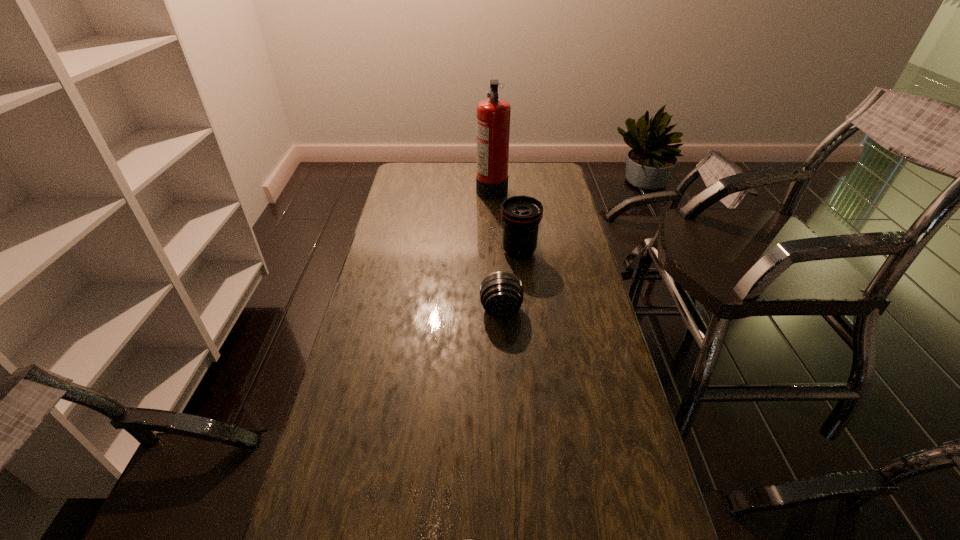
At what (x,y) coordinates should I click in order to perform the action: click on the farthest object. Please return your answer as a coordinate pair (x, y). This screenshot has width=960, height=540. Looking at the image, I should click on (493, 115).

Identify the location of the tallest object. (493, 115).

I want to click on the farthest telephoto lens, so click(x=521, y=215).

The width and height of the screenshot is (960, 540). Identify the location of the second farthest object. (521, 215).

Where is `the second farthest telephoto lens`? the second farthest telephoto lens is located at coordinates (501, 293).

Locate an element on the screen. This screenshot has width=960, height=540. the second tallest telephoto lens is located at coordinates (501, 293).

Identify the location of vacant space situated 0.330m on the front-facing side of the fire extinguisher. This screenshot has height=540, width=960. (407, 187).

This screenshot has width=960, height=540. In order to click on free space located on the front-facing side of the fire extinguisher in this screenshot , I will do `click(428, 187)`.

The image size is (960, 540). I want to click on vacant space located 0.130m on the front-facing side of the fire extinguisher, so click(x=449, y=187).

Find the location of `free region located on the back of the second tallest object`. free region located on the back of the second tallest object is located at coordinates (516, 218).